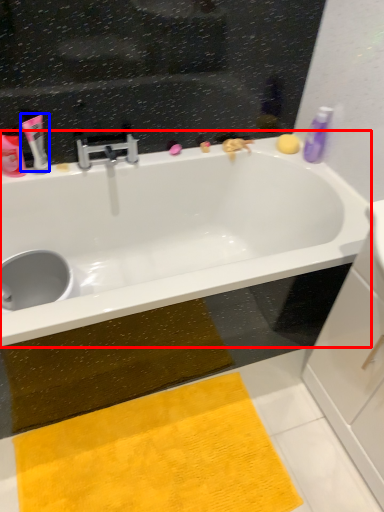
Question: Which object appears farthest to the camera in this image, bathtub (highlighted by a red box) or toiletry (highlighted by a blue box)?

Choices:
 (A) bathtub
 (B) toiletry

Answer: (B)